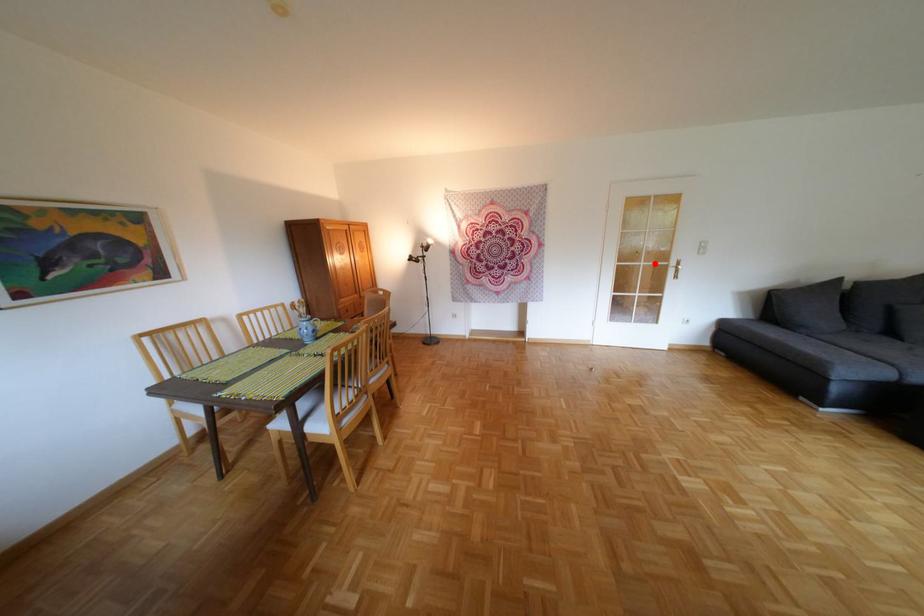
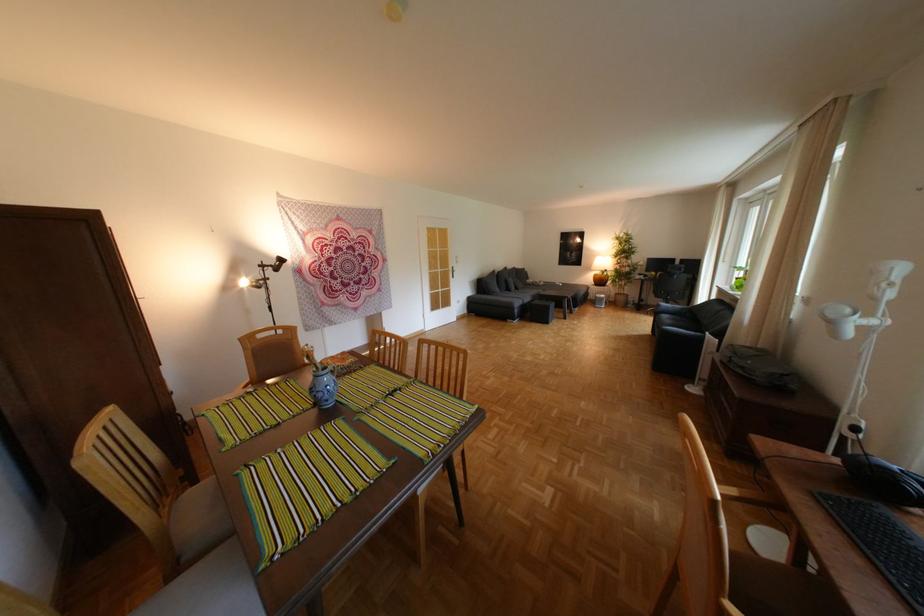
Where in the second image is the point corresponding to the highlighted location from the first image?

(453, 270)